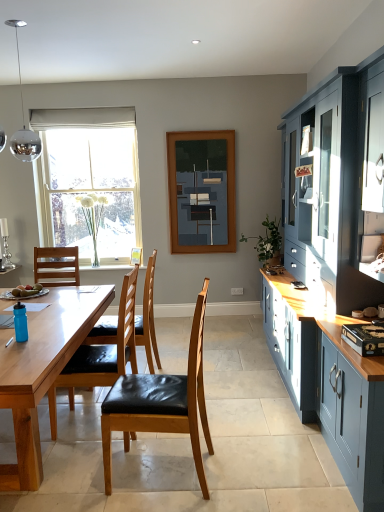
At what (x,y) coordinates should I click in order to perform the action: click on vacant space to the right of teal matte water bottle at table left. Please return your answer as a coordinate pair (x, y). Looking at the image, I should click on (43, 338).